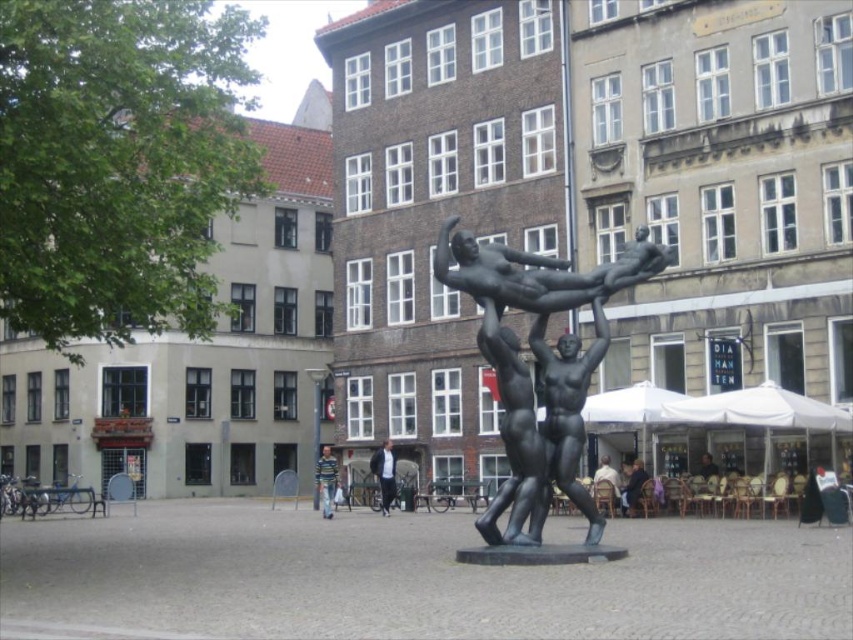
Question: Which object is closer to the camera taking this photo?

Choices:
 (A) dark blue jacket at center
 (B) bronze statue at center
 (C) striped sweater at center

Answer: (B)

Question: Which point is closer to the camera?

Choices:
 (A) bronze statue at center
 (B) light brown wooden chair at lower right
 (C) dark blue jacket at center
 (D) striped sweater at center

Answer: (A)

Question: Can you confirm if dark blue jacket at center is bigger than striped sweater at center?

Choices:
 (A) no
 (B) yes

Answer: (A)

Question: Considering the relative positions of bronze statue at center and light brown wooden chair at lower right in the image provided, where is bronze statue at center located with respect to light brown wooden chair at lower right?

Choices:
 (A) left
 (B) right

Answer: (A)

Question: Does bronze statue at center appear on the right side of light brown wooden chair at lower right?

Choices:
 (A) no
 (B) yes

Answer: (A)

Question: Which object is closer to the camera taking this photo?

Choices:
 (A) light brown wooden chair at lower right
 (B) striped sweater at center
 (C) bronze statue at center

Answer: (C)